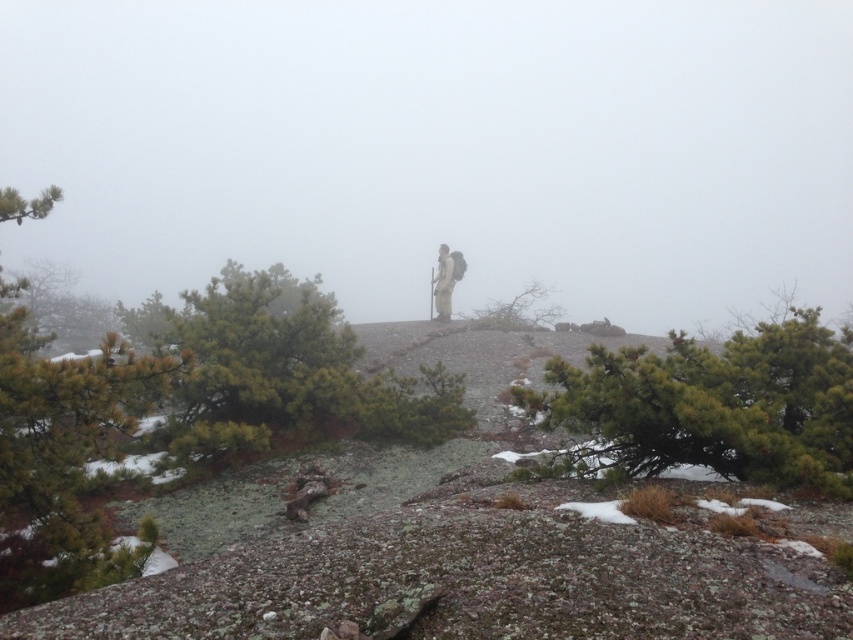
Question: Estimate the real-world distances between objects in this image. Which object is closer to the green matte pine tree at left?

Choices:
 (A) matte gray figure at center
 (B) green textured pine tree at lower right

Answer: (B)

Question: Which point is closer to the camera?

Choices:
 (A) (805, 344)
 (B) (283, 273)
 (C) (495, 314)

Answer: (A)

Question: Is green textured pine tree at lower right further to camera compared to green matte pine tree at left?

Choices:
 (A) no
 (B) yes

Answer: (B)

Question: From the image, what is the correct spatial relationship of green matte pine tree at left in relation to matte gray figure at center?

Choices:
 (A) right
 (B) left

Answer: (B)

Question: Is green textured pine tree at center bigger than matte gray figure at center?

Choices:
 (A) yes
 (B) no

Answer: (A)

Question: Among these objects, which one is nearest to the camera?

Choices:
 (A) green textured pine tree at center
 (B) green leafy tree at center
 (C) green textured pine tree at lower right
 (D) matte gray figure at center

Answer: (C)